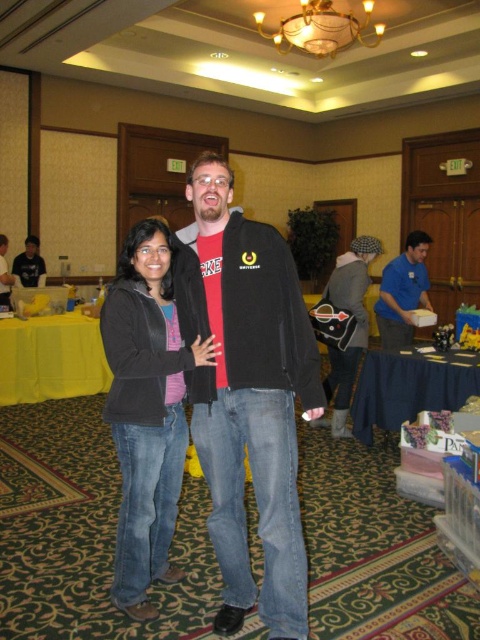
You are a photographer at the event and want to capture a photo of both the blue shirt at center and the matte black jacket at center. Which one should you focus on first if you want to ensure both are in sharp focus?

The blue shirt at center is below matte black jacket at center, so you should focus on the matte black jacket at center first to ensure both are in sharp focus.

You are at a convention and want to take a photo of the blue shirt at center and the matte black jacket at center. Which one is blocking the other from the camera view?

The blue shirt at center is in front of the matte black jacket at center, so it is blocking the matte black jacket at center from the camera view.

You are standing at the entrance of the room and want to find the black soft jacket at center. According to the coordinates provided, in which direction should you move relative to your current position to locate it?

The black soft jacket at center is located at coordinates point (146, 410). Since you are at the entrance, you should move forward and to the right to reach it.